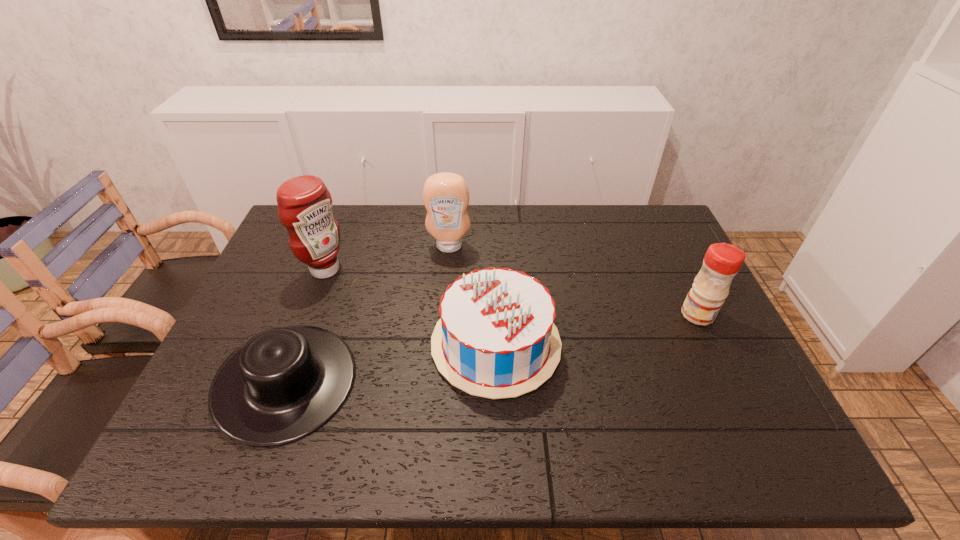
Where is `vacant point located on the back of the rightmost condiment`? The height and width of the screenshot is (540, 960). vacant point located on the back of the rightmost condiment is located at coordinates (667, 253).

You are a GUI agent. You are given a task and a screenshot of the screen. Output one action in this format:
    pyautogui.click(x=<x>, y=<y>)
    Task: Click on the free location located 0.090m on the right of the birthday cake
    This screenshot has width=960, height=540.
    Given the screenshot: What is the action you would take?
    pyautogui.click(x=595, y=344)

The image size is (960, 540). In order to click on free region located 0.270m on the right of the shortest object in this screenshot , I will do `click(468, 382)`.

Identify the location of object present at the far edge. click(446, 196).

Identify the location of object that is at the near edge. This screenshot has width=960, height=540. 285,383.

Locate an element on the screen. condiment positioned at the left edge is located at coordinates (305, 204).

Where is `dress hat that is at the left edge`? The width and height of the screenshot is (960, 540). dress hat that is at the left edge is located at coordinates (285, 383).

Where is `object situated at the right edge`? object situated at the right edge is located at coordinates (722, 261).

Locate an element on the screen. object that is at the near left corner is located at coordinates (285, 383).

In the image, there is a desktop. Where is `vacant space at the far edge`? vacant space at the far edge is located at coordinates point(405,204).